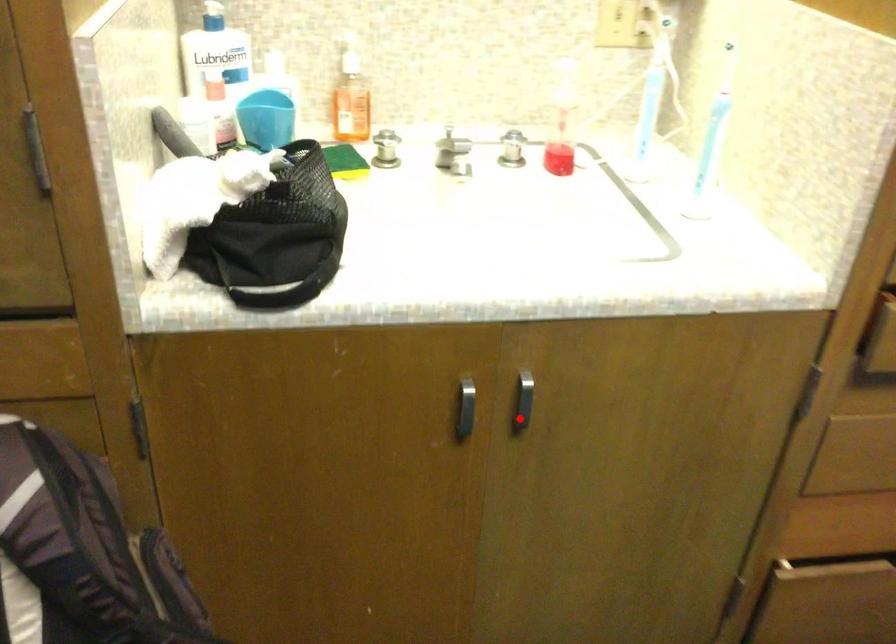
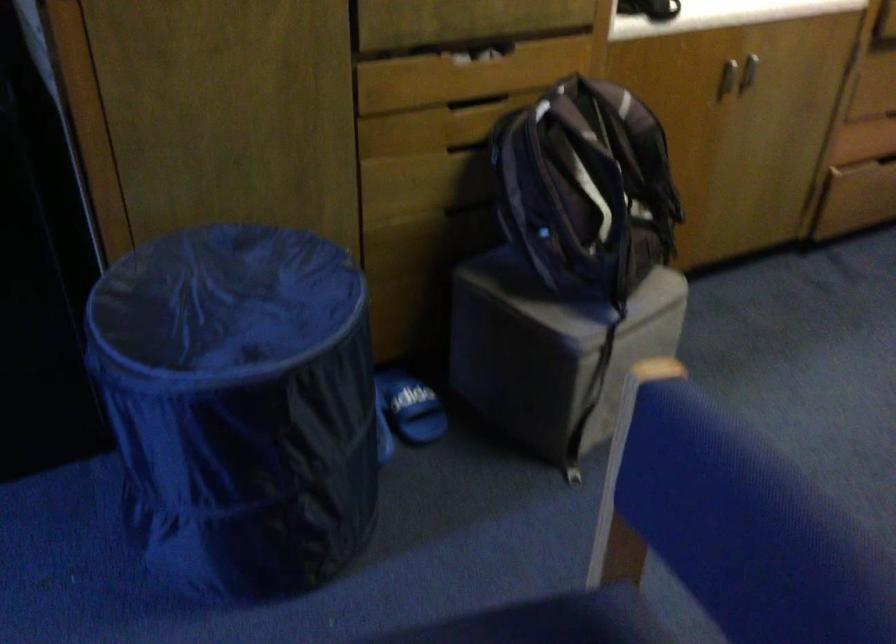
Question: I am providing you with two images of the same scene from different viewpoints. In image1, a red point is highlighted. Considering the same 3D point in image2, which of the following is correct?

Choices:
 (A) It is closer
 (B) It is farther

Answer: (B)